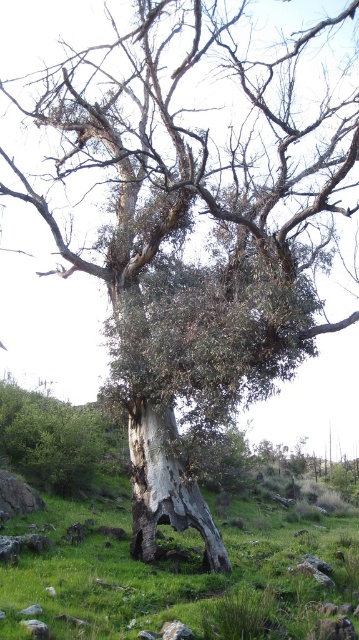
You are standing at the base of the old eucalyptus tree and want to walk towards the green grass at center. In which direction should you head?

The green grass at center is located at point (175, 577) in 2D coordinates, so you should head towards the center of the image where the grass is located.

You are a gardener who needs to water the green grass at center. You have a watering can that can spray water up to 2 meters. The gray rough bark tree trunk at center is in the way. Can you water the grass without moving the tree?

The green grass at center is 2.02 meters away from the gray rough bark tree trunk at center. Since the watering can can spray up to 2 meters, the distance is slightly beyond its range. Therefore, you cannot water the grass without moving the tree.

You are a gardener who wants to plant a new flower bed around the gray rough bark tree trunk at center. Considering the green grass at center is already present, where should you place the flowers relative to the tree trunk?

The green grass at center is positioned under the gray rough bark tree trunk at center, so you should place the flowers around the base of the tree trunk where the grass is located.